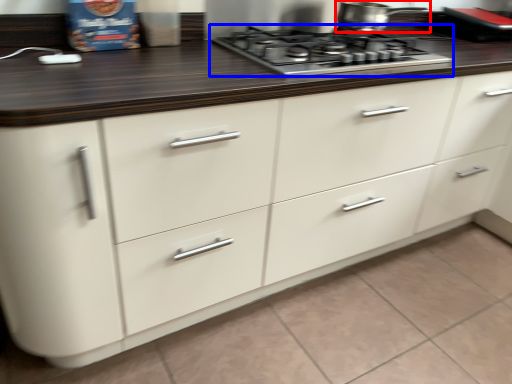
Question: Among these objects, which one is nearest to the camera, kitchen appliance (highlighted by a red box) or gas stove (highlighted by a blue box)?

Choices:
 (A) kitchen appliance
 (B) gas stove

Answer: (B)